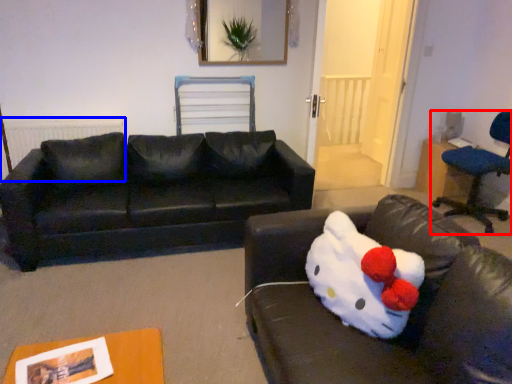
Question: Among these objects, which one is farthest to the camera, chair (highlighted by a red box) or radiator (highlighted by a blue box)?

Choices:
 (A) chair
 (B) radiator

Answer: (B)